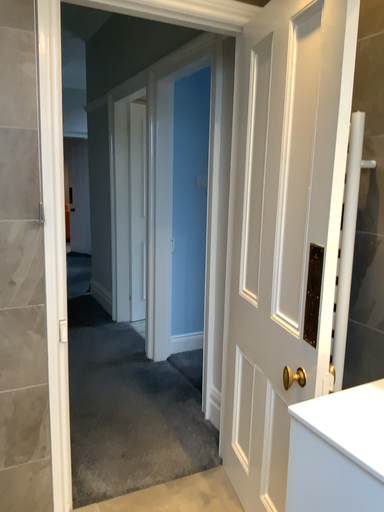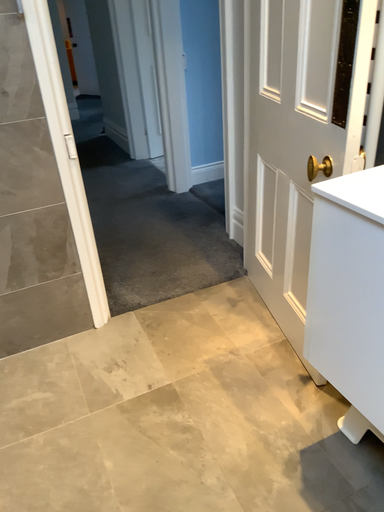
Question: How did the camera likely rotate when shooting the video?

Choices:
 (A) rotated upward
 (B) rotated downward

Answer: (B)